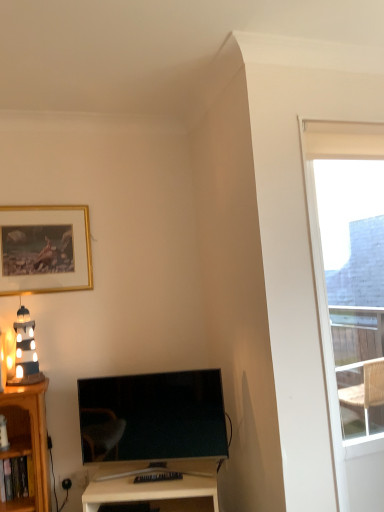
Where is `free spot above white glossy desk at center (from a real-world perspective)`? Image resolution: width=384 pixels, height=512 pixels. free spot above white glossy desk at center (from a real-world perspective) is located at coordinates (149, 477).